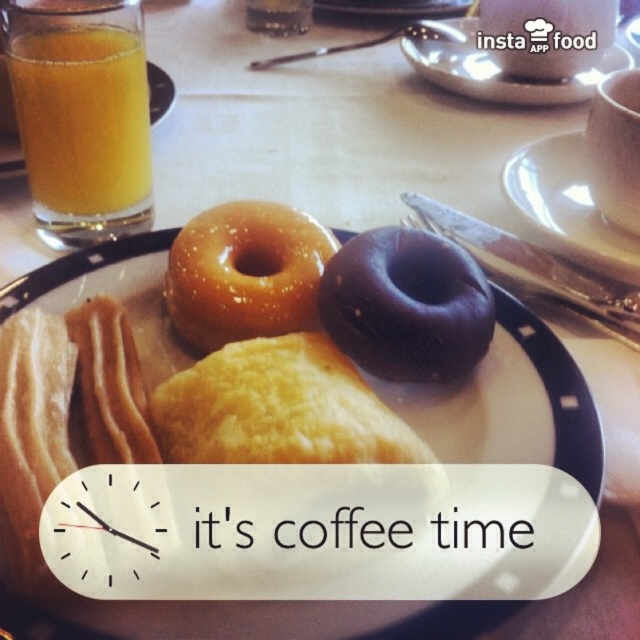
You are a chef who needs to place a 40 cm long spatula between the white glossy plate at upper right and the orange liquid at upper left. Can you fit it horizontally without touching either?

The white glossy plate at upper right and orange liquid at upper left are 41.03 centimeters apart, so yes, the 40 cm long spatula can fit horizontally between them without touching either object.

You are planning to serve a dessert platter and want to arrange the chocolate glazed donut at center and the matte glazed donuts at center on a small plate. Given that the plate has limited space, which of the two items should you place first to ensure both fit?

The chocolate glazed donut at center occupies less space than the matte glazed donuts at center, so you should place the matte glazed donuts at center first to ensure both fit on the plate.